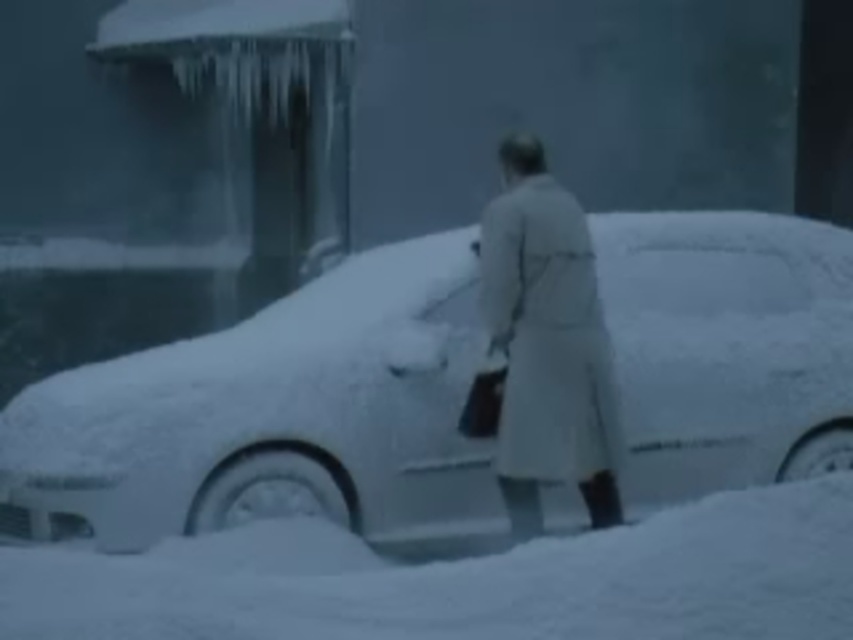
You are a delivery person who needs to place a package on the ground next to the white matte car at center. Considering the distance between the car and the white fluffy snow at lower center, is there enough space to place the package there without it touching the snow?

The white matte car at center is 5.47 feet from the white fluffy snow at lower center. Since 5.47 feet is a sufficient distance, the package can be placed between them without touching the snow.

You are a delivery person trying to reach the driver side door of the white matte car at center. There is white fluffy snow at lower center in your way. Can you walk around it to reach the car?

The white fluffy snow at lower center is behind the white matte car at center, so you can walk around it to reach the driver side door of the white matte car at center.